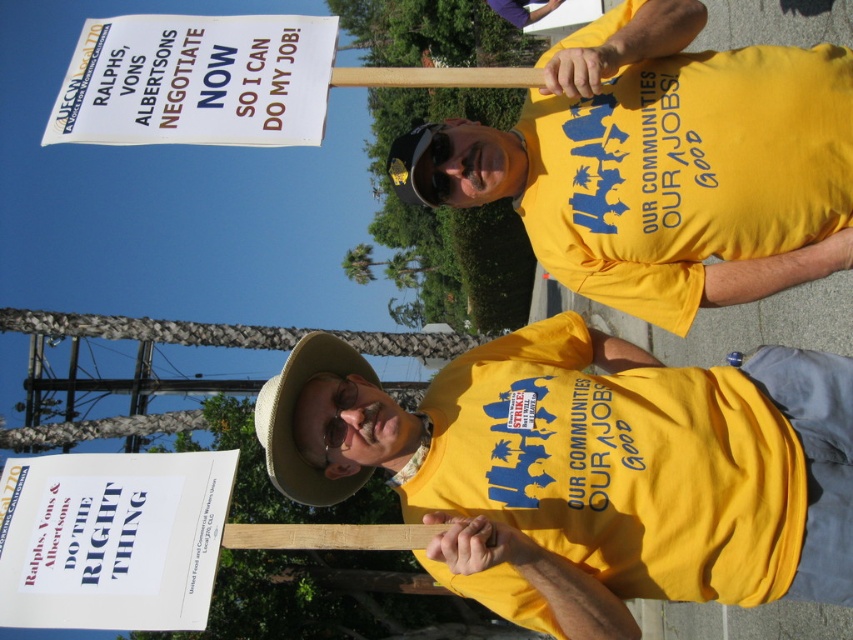
Measure the distance from yellow cotton shirt at upper right to white paper sign at upper left.

A distance of 1.26 meters exists between yellow cotton shirt at upper right and white paper sign at upper left.

Does point (825, 163) come closer to viewer compared to point (322, 54)?

That is False.

Is point (666, 148) positioned behind point (178, 29)?

That is False.

The width and height of the screenshot is (853, 640). In order to click on yellow cotton shirt at upper right in this screenshot , I will do `click(666, 177)`.

Image resolution: width=853 pixels, height=640 pixels. I want to click on yellow cotton shirt at upper right, so [x=666, y=177].

Between point (619, 161) and point (293, 387), which one is positioned behind?

The point (619, 161) is more distant.

Is point (697, 260) farther from camera compared to point (309, 499)?

Yes, it is behind point (309, 499).

The height and width of the screenshot is (640, 853). I want to click on yellow cotton shirt at upper right, so click(x=666, y=177).

Who is positioned more to the right, yellow cotton shirt at center or white paper sign at upper left?

yellow cotton shirt at center is more to the right.

Is point (773, 433) less distant than point (161, 67)?

Yes.

You are a GUI agent. You are given a task and a screenshot of the screen. Output one action in this format:
    pyautogui.click(x=<x>, y=<y>)
    Task: Click on the yellow cotton shirt at center
    
    Given the screenshot: What is the action you would take?
    pyautogui.click(x=595, y=458)